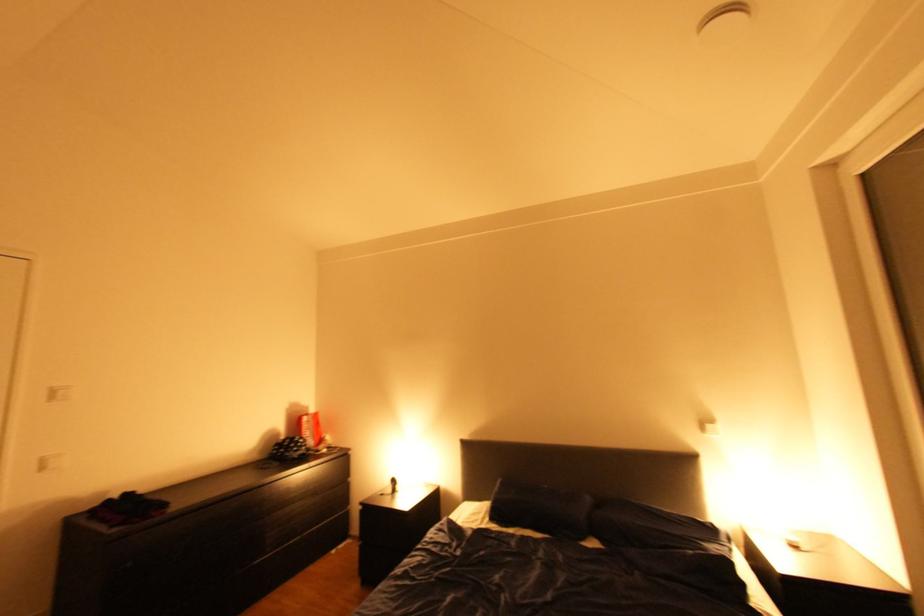
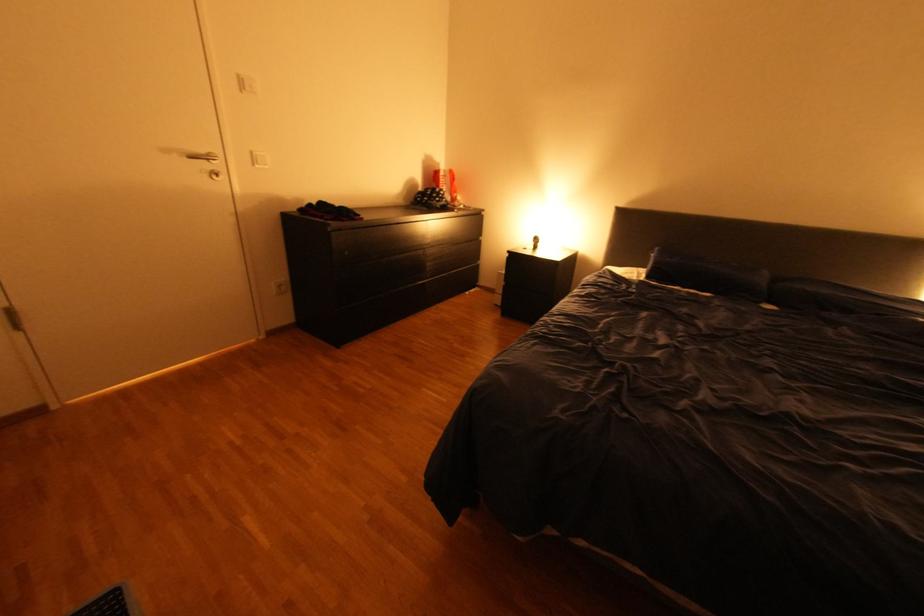
The point at [312,444] is marked in the first image. Where is the corresponding point in the second image?

(454, 196)